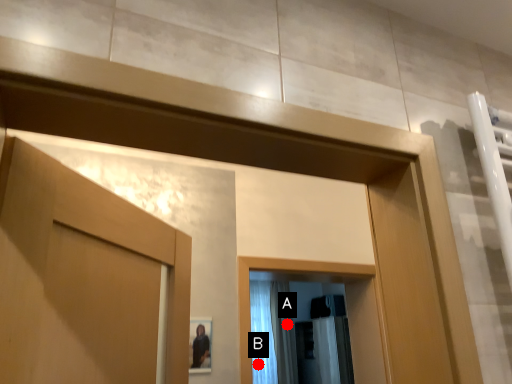
Question: Two points are circled on the image, labeled by A and B beside each circle. Among these points, which one is farthest from the camera?

Choices:
 (A) A is further
 (B) B is further

Answer: (A)